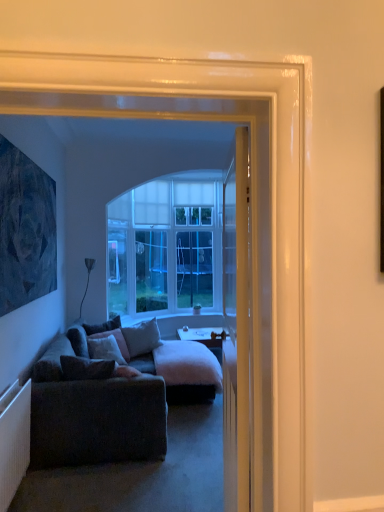
Question: Considering the relative positions of smooth wooden desk at center and velvet gray pillow at center, the 2th pillow from the front, in the image provided, is smooth wooden desk at center to the right of velvet gray pillow at center, the 2th pillow from the front, from the viewer's perspective?

Choices:
 (A) yes
 (B) no

Answer: (A)

Question: Does smooth wooden desk at center have a larger size compared to velvet gray pillow at center, the 2th pillow from the front?

Choices:
 (A) no
 (B) yes

Answer: (B)

Question: Is smooth wooden desk at center looking in the opposite direction of velvet gray pillow at center, marked as the 3th pillow in a back-to-front arrangement?

Choices:
 (A) yes
 (B) no

Answer: (B)

Question: Are smooth wooden desk at center and velvet gray pillow at center, marked as the 3th pillow in a back-to-front arrangement, beside each other?

Choices:
 (A) yes
 (B) no

Answer: (B)

Question: Considering the relative sizes of smooth wooden desk at center and velvet gray pillow at center, the 2th pillow from the front, in the image provided, is smooth wooden desk at center smaller than velvet gray pillow at center, the 2th pillow from the front,?

Choices:
 (A) yes
 (B) no

Answer: (B)

Question: From their relative heights in the image, would you say white textured radiator at lower left is taller or shorter than velvet gray pillow at center, marked as the 3th pillow in a back-to-front arrangement?

Choices:
 (A) short
 (B) tall

Answer: (B)

Question: From the image's perspective, relative to velvet gray pillow at center, marked as the 3th pillow in a back-to-front arrangement, is white textured radiator at lower left above or below?

Choices:
 (A) above
 (B) below

Answer: (B)

Question: Considering the positions of white textured radiator at lower left and velvet gray pillow at center, marked as the 3th pillow in a back-to-front arrangement, in the image, is white textured radiator at lower left wider or thinner than velvet gray pillow at center, marked as the 3th pillow in a back-to-front arrangement,?

Choices:
 (A) thin
 (B) wide

Answer: (A)

Question: Would you say white textured radiator at lower left is to the left or to the right of velvet gray pillow at center, marked as the 3th pillow in a back-to-front arrangement, in the picture?

Choices:
 (A) right
 (B) left

Answer: (B)

Question: Considering the positions of point (87, 331) and point (16, 179), is point (87, 331) closer or farther from the camera than point (16, 179)?

Choices:
 (A) closer
 (B) farther

Answer: (B)

Question: Is velvet gray pillow at center, acting as the 1th pillow starting from the back, spatially inside dark blue textured painting at left, or outside of it?

Choices:
 (A) inside
 (B) outside

Answer: (B)

Question: Is velvet gray pillow at center, acting as the 1th pillow starting from the back, in front of or behind dark blue textured painting at left in the image?

Choices:
 (A) front
 (B) behind

Answer: (B)

Question: Would you say velvet gray pillow at center, which appears as the fourth pillow when viewed from the front, is to the left or to the right of dark blue textured painting at left in the picture?

Choices:
 (A) right
 (B) left

Answer: (A)

Question: From the image's perspective, is gray fabric pillow at center, which is the second pillow from back to front, positioned above or below smooth wooden desk at center?

Choices:
 (A) below
 (B) above

Answer: (B)

Question: In terms of size, does gray fabric pillow at center, which is the second pillow from back to front, appear bigger or smaller than smooth wooden desk at center?

Choices:
 (A) small
 (B) big

Answer: (A)